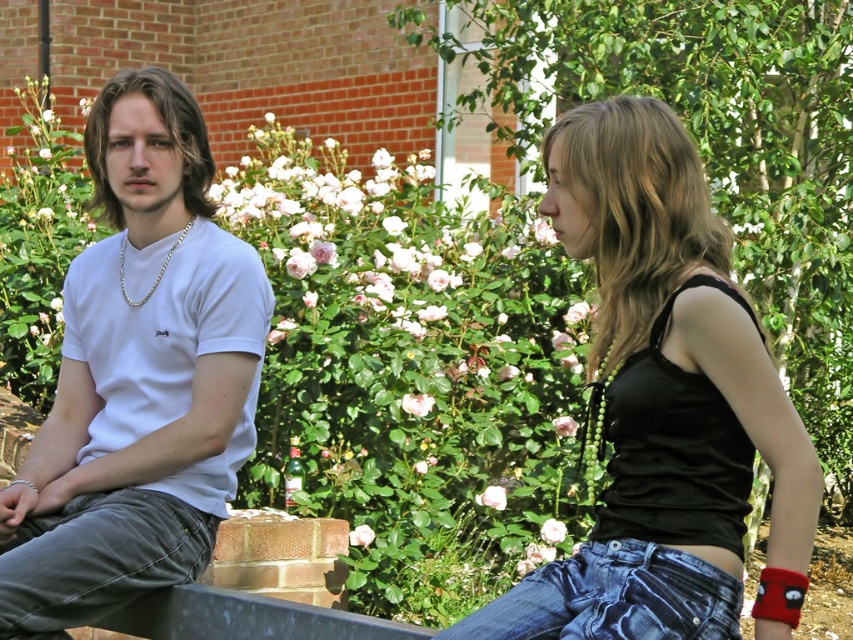
Based on the photo, can you confirm if denim at left is positioned to the left of blue denim jeans at lower right?

Correct, you'll find denim at left to the left of blue denim jeans at lower right.

Image resolution: width=853 pixels, height=640 pixels. What do you see at coordinates (97, 557) in the screenshot?
I see `denim at left` at bounding box center [97, 557].

What are the coordinates of `denim at left` in the screenshot? It's located at (97, 557).

Measure the distance between black satin tank top at right and blue denim jeans at lower right.

black satin tank top at right is 8.08 inches away from blue denim jeans at lower right.

Is black satin tank top at right bigger than blue denim jeans at lower right?

Yes.

Does point (692, 618) come behind point (705, 598)?

That is False.

Image resolution: width=853 pixels, height=640 pixels. What are the coordinates of `black satin tank top at right` in the screenshot? It's located at (664, 404).

Does black satin tank top at right appear on the right side of white matte t-shirt at left?

Indeed, black satin tank top at right is positioned on the right side of white matte t-shirt at left.

Does black satin tank top at right have a lesser width compared to white matte t-shirt at left?

Correct, black satin tank top at right's width is less than white matte t-shirt at left's.

Who is more distant from viewer, (734, 493) or (206, 385)?

Positioned behind is point (206, 385).

At what (x,y) coordinates should I click in order to perform the action: click on black satin tank top at right. Please return your answer as a coordinate pair (x, y). Image resolution: width=853 pixels, height=640 pixels. Looking at the image, I should click on (664, 404).